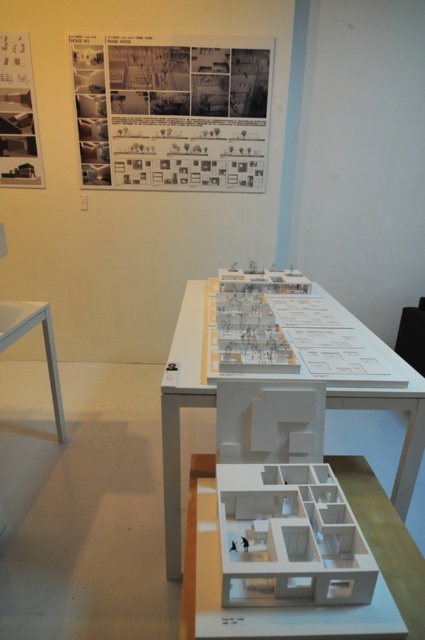
Does point (164, 461) come closer to viewer compared to point (22, 147)?

Yes, point (164, 461) is closer to viewer.

Is white matte model at center above white paper poster at upper left?

No.

The width and height of the screenshot is (425, 640). What do you see at coordinates (180, 410) in the screenshot?
I see `white matte model at center` at bounding box center [180, 410].

You are a GUI agent. You are given a task and a screenshot of the screen. Output one action in this format:
    pyautogui.click(x=<x>, y=<y>)
    Task: Click on the white matte model at center
    The width and height of the screenshot is (425, 640).
    Given the screenshot: What is the action you would take?
    pyautogui.click(x=180, y=410)

Is white matte model house at center positioned at the back of white glossy table at left?

That is False.

Which is more to the left, white matte model house at center or white glossy table at left?

white glossy table at left is more to the left.

Is point (408, 582) positioned in front of point (14, 326)?

That is True.

Where is `white matte model house at center`? The width and height of the screenshot is (425, 640). white matte model house at center is located at coordinates (385, 544).

Is point (153, 113) behind point (0, 92)?

That is True.

Measure the distance between black paper at upper center and white paper poster at upper left.

The distance of black paper at upper center from white paper poster at upper left is 28.00 inches.

Who is more forward, (181, 157) or (8, 141)?

Point (8, 141)

Find the location of `black paper at upper center`. black paper at upper center is located at coordinates (172, 112).